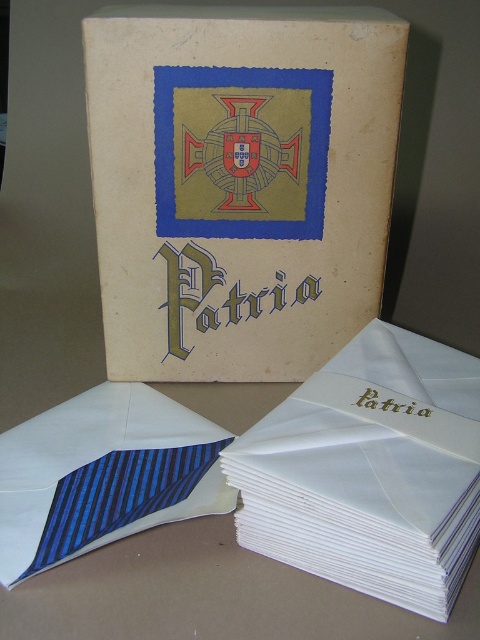
Which is above, matte cardboard box at center or blue striped tie at lower left?

matte cardboard box at center

Is point (252, 326) in front of point (215, 458)?

No, (252, 326) is behind (215, 458).

The width and height of the screenshot is (480, 640). Describe the element at coordinates (240, 184) in the screenshot. I see `matte cardboard box at center` at that location.

At what (x,y) coordinates should I click in order to perform the action: click on matte cardboard box at center. Please return your answer as a coordinate pair (x, y). This screenshot has width=480, height=640. Looking at the image, I should click on (240, 184).

Can you confirm if matte cardboard box at center is smaller than white paper book at center?

Incorrect, matte cardboard box at center is not smaller in size than white paper book at center.

Who is taller, matte cardboard box at center or white paper book at center?

With more height is matte cardboard box at center.

Identify the location of matte cardboard box at center. (240, 184).

Can you confirm if white paper book at center is shorter than blue striped tie at lower left?

Incorrect, white paper book at center's height does not fall short of blue striped tie at lower left's.

Is point (392, 589) farther from viewer compared to point (143, 513)?

No.

Locate an element on the screen. white paper book at center is located at coordinates (370, 472).

I want to click on white paper book at center, so click(370, 472).